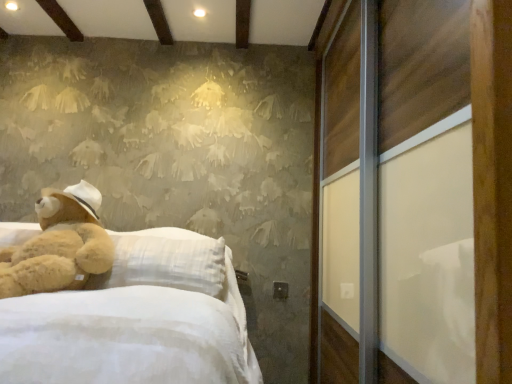
Question: Considering the relative positions of soft brown plush at left and wooden sliding door at right in the image provided, is soft brown plush at left to the left of wooden sliding door at right from the viewer's perspective?

Choices:
 (A) yes
 (B) no

Answer: (A)

Question: Is soft brown plush at left positioned beyond the bounds of wooden sliding door at right?

Choices:
 (A) yes
 (B) no

Answer: (A)

Question: Does soft brown plush at left have a smaller size compared to wooden sliding door at right?

Choices:
 (A) yes
 (B) no

Answer: (A)

Question: Is soft brown plush at left oriented away from wooden sliding door at right?

Choices:
 (A) yes
 (B) no

Answer: (B)

Question: Is soft brown plush at left bigger than wooden sliding door at right?

Choices:
 (A) yes
 (B) no

Answer: (B)

Question: Can you confirm if soft brown plush at left is wider than wooden sliding door at right?

Choices:
 (A) yes
 (B) no

Answer: (B)

Question: From a real-world perspective, is wooden sliding door at right on top of soft brown plush at left?

Choices:
 (A) yes
 (B) no

Answer: (A)

Question: Is wooden sliding door at right smaller than soft brown plush at left?

Choices:
 (A) yes
 (B) no

Answer: (B)

Question: Does wooden sliding door at right have a greater width compared to soft brown plush at left?

Choices:
 (A) yes
 (B) no

Answer: (A)

Question: Does wooden sliding door at right come behind soft brown plush at left?

Choices:
 (A) yes
 (B) no

Answer: (B)

Question: Can you confirm if wooden sliding door at right is positioned to the right of soft brown plush at left?

Choices:
 (A) yes
 (B) no

Answer: (A)

Question: From the image's perspective, is wooden sliding door at right located above soft brown plush at left?

Choices:
 (A) yes
 (B) no

Answer: (A)

Question: From the image's perspective, is soft brown plush at left positioned above or below wooden sliding door at right?

Choices:
 (A) below
 (B) above

Answer: (A)